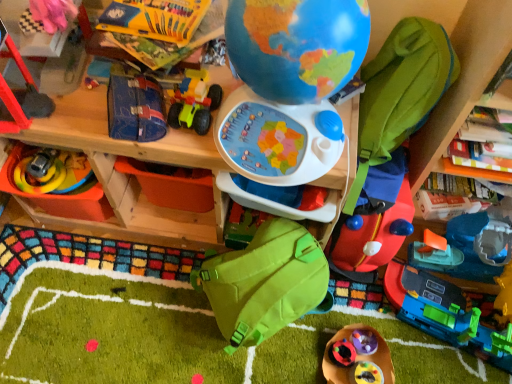
Find the location of a particular element. The width and height of the screenshot is (512, 384). rubberized red ladder at left, which is the 2th toy in left-to-right order is located at coordinates click(22, 93).

The image size is (512, 384). Describe the element at coordinates (366, 373) in the screenshot. I see `matte plastic toy at lower center, marked as the eighth toy in a left-to-right arrangement` at that location.

This screenshot has width=512, height=384. I want to click on matte plastic crayons at upper left, which ranks as the fourth toy in left-to-right order, so click(x=155, y=19).

Is matte plastic crayons at upper left, which ranks as the fourth toy in left-to-right order, to the left of rubberized red ladder at left, which is the 2th toy in left-to-right order, from the viewer's perspective?

In fact, matte plastic crayons at upper left, which ranks as the fourth toy in left-to-right order, is to the right of rubberized red ladder at left, which is the 2th toy in left-to-right order.

This screenshot has width=512, height=384. What are the coordinates of `toy that is the 1st one when counting downward from the matte plastic crayons at upper left, the eighth toy viewed from the right (from the image's perspective)` in the screenshot? It's located at (22, 93).

Does matte plastic crayons at upper left, the eighth toy viewed from the right, touch rubberized red ladder at left, which appears as the 10th toy when viewed from the right?

matte plastic crayons at upper left, the eighth toy viewed from the right, and rubberized red ladder at left, which appears as the 10th toy when viewed from the right, are clearly separated.

Which is in front, point (185, 42) or point (25, 113)?

The point (25, 113) is more forward.

From a real-world perspective, is matte plastic crayons at upper left, which ranks as the fourth toy in left-to-right order, on rubberized plastic toy at lower center, the 3th toy viewed from the right?

Yes, from a real-world perspective, matte plastic crayons at upper left, which ranks as the fourth toy in left-to-right order, is over rubberized plastic toy at lower center, the 3th toy viewed from the right

Is matte plastic crayons at upper left, which ranks as the fourth toy in left-to-right order, facing towards rubberized plastic toy at lower center, which ranks as the 9th toy in left-to-right order?

No, matte plastic crayons at upper left, which ranks as the fourth toy in left-to-right order, does not turn towards rubberized plastic toy at lower center, which ranks as the 9th toy in left-to-right order.

Looking at this image, how much distance is there between matte plastic crayons at upper left, the eighth toy viewed from the right, and rubberized plastic toy at lower center, the 3th toy viewed from the right?

matte plastic crayons at upper left, the eighth toy viewed from the right, is 37.64 inches from rubberized plastic toy at lower center, the 3th toy viewed from the right.

Can you tell me how much matte plastic crayons at upper left, which ranks as the fourth toy in left-to-right order, and rubberized plastic toy at lower center, which ranks as the 9th toy in left-to-right order, differ in facing direction?

The angular difference between matte plastic crayons at upper left, which ranks as the fourth toy in left-to-right order, and rubberized plastic toy at lower center, which ranks as the 9th toy in left-to-right order, is 0.0713 degrees.

Which is more to the left, green matte backpack at center, the seventh toy when ordered from right to left, or wooden table at center?

From the viewer's perspective, wooden table at center appears more on the left side.

Measure the distance between green matte backpack at center, positioned as the fifth toy in left-to-right order, and wooden table at center.

10.40 inches.

Which object is more forward, green matte backpack at center, the seventh toy when ordered from right to left, or wooden table at center?

wooden table at center is in front.

Does green matte backpack at center, positioned as the fifth toy in left-to-right order, have a lesser height compared to wooden table at center?

Yes.

Are rubberized red backpack at center-right, acting as the eleventh toy starting from the left, and blue fabric case at center, which ranks as the 3th toy in left-to-right order, far apart?

That's not correct — rubberized red backpack at center-right, acting as the eleventh toy starting from the left, is a little close to blue fabric case at center, which ranks as the 3th toy in left-to-right order.

Is rubberized red backpack at center-right, which is the first toy in right-to-left order, to the left of blue fabric case at center, positioned as the 9th toy in right-to-left order, from the viewer's perspective?

No.

From their relative heights in the image, would you say rubberized red backpack at center-right, acting as the eleventh toy starting from the left, is taller or shorter than blue fabric case at center, positioned as the 9th toy in right-to-left order?

In the image, rubberized red backpack at center-right, acting as the eleventh toy starting from the left, appears to be taller than blue fabric case at center, positioned as the 9th toy in right-to-left order.

Is matte plastic toy at lower center, marked as the eighth toy in a left-to-right arrangement, shorter than shiny purple toy at lower center, which is counted as the 10th toy, starting from the left?

No.

How many degrees apart are the facing directions of matte plastic toy at lower center, marked as the eighth toy in a left-to-right arrangement, and shiny purple toy at lower center, the second toy from the right?

There is a 0.00321-degree angle between the facing directions of matte plastic toy at lower center, marked as the eighth toy in a left-to-right arrangement, and shiny purple toy at lower center, the second toy from the right.

From a real-world perspective, does matte plastic toy at lower center, which is counted as the 4th toy, starting from the right, sit lower than shiny purple toy at lower center, the second toy from the right?

No.

Would you say rubberized plastic toy at lower center, which ranks as the 9th toy in left-to-right order, is outside green matte backpack at center, positioned as the fifth toy in left-to-right order?

Yes, rubberized plastic toy at lower center, which ranks as the 9th toy in left-to-right order, is located beyond the bounds of green matte backpack at center, positioned as the fifth toy in left-to-right order.

In the image, is rubberized plastic toy at lower center, which ranks as the 9th toy in left-to-right order, positioned in front of or behind green matte backpack at center, positioned as the fifth toy in left-to-right order?

rubberized plastic toy at lower center, which ranks as the 9th toy in left-to-right order, is positioned closer to the viewer than green matte backpack at center, positioned as the fifth toy in left-to-right order.

From a real-world perspective, is rubberized plastic toy at lower center, which ranks as the 9th toy in left-to-right order, physically located above or below green matte backpack at center, positioned as the fifth toy in left-to-right order?

From a real-world perspective, rubberized plastic toy at lower center, which ranks as the 9th toy in left-to-right order, is physically below green matte backpack at center, positioned as the fifth toy in left-to-right order.

Would you consider rubberized plastic toy at lower center, the 3th toy viewed from the right, to be distant from green matte backpack at center, positioned as the fifth toy in left-to-right order?

No.

Measure the distance from rubberized red backpack at center-right, which is the first toy in right-to-left order, to rubberized black toy at lower center, which appears as the 5th toy when viewed from the right.

11.83 inches.

Does rubberized red backpack at center-right, which is the first toy in right-to-left order, contain rubberized black toy at lower center, which appears as the 5th toy when viewed from the right?

No, rubberized black toy at lower center, which appears as the 5th toy when viewed from the right, is located outside of rubberized red backpack at center-right, which is the first toy in right-to-left order.

How many degrees apart are the facing directions of rubberized red backpack at center-right, which is the first toy in right-to-left order, and rubberized black toy at lower center, marked as the seventh toy in a left-to-right arrangement?

The angular difference between rubberized red backpack at center-right, which is the first toy in right-to-left order, and rubberized black toy at lower center, marked as the seventh toy in a left-to-right arrangement, is 0.00042 degrees.

From the rubberized red backpack at center-right, which is the first toy in right-to-left order, count 3rd toys backward and point to it. Please provide its 2D coordinates.

[(342, 353)]

What are the coordinates of `toy above the rubberized red ladder at left, which appears as the 10th toy when viewed from the right (from the image's perspective)` in the screenshot? It's located at (155, 19).

Which toy is the 5th one when counting from the left side of the rubberized plastic toy at lower center, which ranks as the 9th toy in left-to-right order? Please provide its 2D coordinates.

[(155, 19)]

Considering their positions, is green matte backpack at center, the seventh toy when ordered from right to left, positioned further to rubberized plastic toy at lower center, the 3th toy viewed from the right, than matte plastic toy at lower center, marked as the eighth toy in a left-to-right arrangement?

green matte backpack at center, the seventh toy when ordered from right to left, is positioned further to the anchor rubberized plastic toy at lower center, the 3th toy viewed from the right.

Considering their positions, is blue fabric case at center, which ranks as the 3th toy in left-to-right order, positioned further to shiny purple toy at lower center, the second toy from the right, than green fabric backpack at lower center, which appears as the 6th toy when viewed from the left?

blue fabric case at center, which ranks as the 3th toy in left-to-right order, is further to shiny purple toy at lower center, the second toy from the right.

Consider the image. Based on their spatial positions, is matte plastic toy at lower center, marked as the eighth toy in a left-to-right arrangement, or wooden table at center closer to green fabric backpack at lower center, which ranks as the sixth toy in right-to-left order?

wooden table at center is positioned closer to the anchor green fabric backpack at lower center, which ranks as the sixth toy in right-to-left order.

When comparing their distances from wooden table at center, does rubberized red backpack at center-right, acting as the eleventh toy starting from the left, or matte plastic toy at lower center, marked as the eighth toy in a left-to-right arrangement, seem closer?

rubberized red backpack at center-right, acting as the eleventh toy starting from the left.

Based on their spatial positions, is rubberized plastic toy at lower center, which ranks as the 9th toy in left-to-right order, or matte plastic crayons at upper left, which ranks as the fourth toy in left-to-right order, further from blue fabric case at center, positioned as the 9th toy in right-to-left order?

Based on the image, rubberized plastic toy at lower center, which ranks as the 9th toy in left-to-right order, appears to be further to blue fabric case at center, positioned as the 9th toy in right-to-left order.

When comparing their distances from metallic silver car at lower left, arranged as the eleventh toy when viewed from the right, does wooden table at center or green matte backpack at center, positioned as the fifth toy in left-to-right order, seem further?

green matte backpack at center, positioned as the fifth toy in left-to-right order, is further to metallic silver car at lower left, arranged as the eleventh toy when viewed from the right.

Based on their spatial positions, is shiny purple toy at lower center, which is counted as the 10th toy, starting from the left, or green matte backpack at center, the seventh toy when ordered from right to left, further from rubberized black toy at lower center, marked as the seventh toy in a left-to-right arrangement?

green matte backpack at center, the seventh toy when ordered from right to left, lies further to rubberized black toy at lower center, marked as the seventh toy in a left-to-right arrangement, than the other object.

When comparing their distances from matte plastic crayons at upper left, the eighth toy viewed from the right, does wooden table at center or shiny purple toy at lower center, the second toy from the right, seem further?

shiny purple toy at lower center, the second toy from the right, lies further to matte plastic crayons at upper left, the eighth toy viewed from the right, than the other object.

The image size is (512, 384). I want to click on table between metallic silver car at lower left, placed as the 1th toy when sorted from left to right, and shiny purple toy at lower center, which is counted as the 10th toy, starting from the left, from left to right, so click(128, 175).

At what (x,y) coordinates should I click in order to perform the action: click on table between blue fabric case at center, which ranks as the 3th toy in left-to-right order, and rubberized black toy at lower center, marked as the seventh toy in a left-to-right arrangement, vertically. Please return your answer as a coordinate pair (x, y). This screenshot has height=384, width=512. Looking at the image, I should click on (128, 175).

You are a GUI agent. You are given a task and a screenshot of the screen. Output one action in this format:
    pyautogui.click(x=<x>, y=<y>)
    Task: Click on the toy between rubberized black toy at lower center, which appears as the 5th toy when viewed from the right, and rubberized plastic toy at lower center, which ranks as the 9th toy in left-to-right order, from left to right
    The width and height of the screenshot is (512, 384).
    Given the screenshot: What is the action you would take?
    pyautogui.click(x=366, y=373)

Find the location of a particular element. table between matte plastic crayons at upper left, the eighth toy viewed from the right, and rubberized red backpack at center-right, which is the first toy in right-to-left order, from left to right is located at coordinates (128, 175).